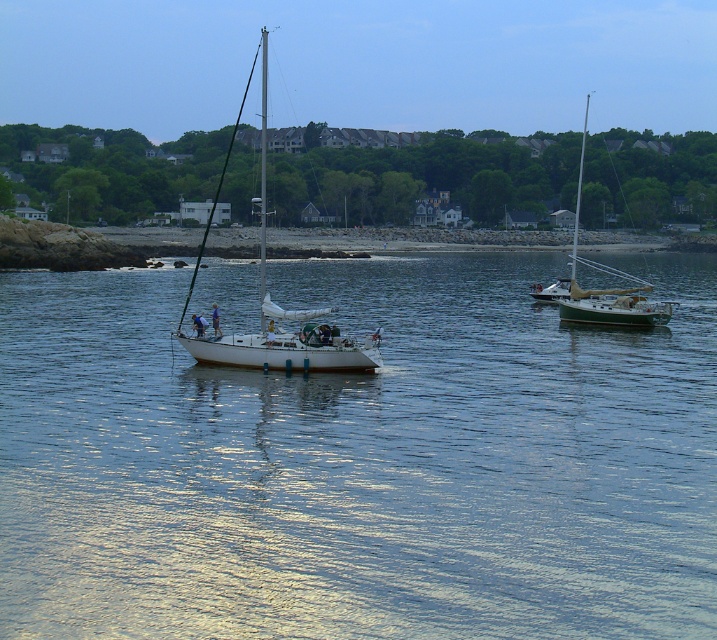
You are standing at the point with coordinates point (358, 461). What do you see around you?

You are standing in clear blue water at center, as point (358, 461) corresponds to clear blue water at center.

You are standing on the smooth sand shoreline at center and want to reach the white glossy sailboat at right. Which direction should you walk to get closer to the sailboat?

You should walk away from the smooth sand shoreline at center towards the water because the white glossy sailboat at right is further away from you compared to the shoreline.

You are a photographer planning to capture the white glossy sailboat at center and the clear blue water at center in a single shot. Based on the scene, which of these two elements occupies a larger portion of the image?

The clear blue water at center might be wider than the white glossy sailboat at center, so it likely occupies a larger portion of the image.